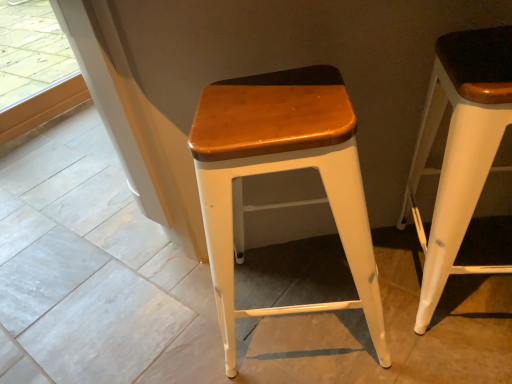
Question: Considering the relative positions of wooden seat at center, the 2th stool from the right, and white matte wood stool at right, acting as the second stool starting from the left, in the image provided, is wooden seat at center, the 2th stool from the right, to the left of white matte wood stool at right, acting as the second stool starting from the left, from the viewer's perspective?

Choices:
 (A) no
 (B) yes

Answer: (B)

Question: Does wooden seat at center, the first stool from the left, have a greater width compared to white matte wood stool at right, acting as the second stool starting from the left?

Choices:
 (A) yes
 (B) no

Answer: (A)

Question: Is wooden seat at center, the 2th stool from the right, positioned in front of white matte wood stool at right, positioned as the 1th stool in right-to-left order?

Choices:
 (A) yes
 (B) no

Answer: (B)

Question: Considering the relative sizes of wooden seat at center, the 2th stool from the right, and white matte wood stool at right, positioned as the 1th stool in right-to-left order, in the image provided, is wooden seat at center, the 2th stool from the right, bigger than white matte wood stool at right, positioned as the 1th stool in right-to-left order,?

Choices:
 (A) no
 (B) yes

Answer: (B)

Question: Is wooden seat at center, the 2th stool from the right, not inside white matte wood stool at right, acting as the second stool starting from the left?

Choices:
 (A) no
 (B) yes

Answer: (B)

Question: Is wooden seat at center, the 2th stool from the right, not near white matte wood stool at right, acting as the second stool starting from the left?

Choices:
 (A) no
 (B) yes

Answer: (A)

Question: Is white matte wood stool at right, acting as the second stool starting from the left, thinner than wooden seat at center, the 2th stool from the right?

Choices:
 (A) no
 (B) yes

Answer: (B)

Question: Is white matte wood stool at right, positioned as the 1th stool in right-to-left order, located outside wooden seat at center, the first stool from the left?

Choices:
 (A) no
 (B) yes

Answer: (B)

Question: From the image's perspective, does white matte wood stool at right, positioned as the 1th stool in right-to-left order, appear higher than wooden seat at center, the first stool from the left?

Choices:
 (A) yes
 (B) no

Answer: (A)

Question: Does white matte wood stool at right, acting as the second stool starting from the left, lie behind wooden seat at center, the 2th stool from the right?

Choices:
 (A) no
 (B) yes

Answer: (A)

Question: Does white matte wood stool at right, acting as the second stool starting from the left, have a greater height compared to wooden seat at center, the first stool from the left?

Choices:
 (A) no
 (B) yes

Answer: (B)

Question: Does white matte wood stool at right, acting as the second stool starting from the left, touch wooden seat at center, the first stool from the left?

Choices:
 (A) yes
 (B) no

Answer: (B)

Question: Based on their positions, is white matte wood stool at right, positioned as the 1th stool in right-to-left order, located to the left or right of wooden seat at center, the first stool from the left?

Choices:
 (A) left
 (B) right

Answer: (B)